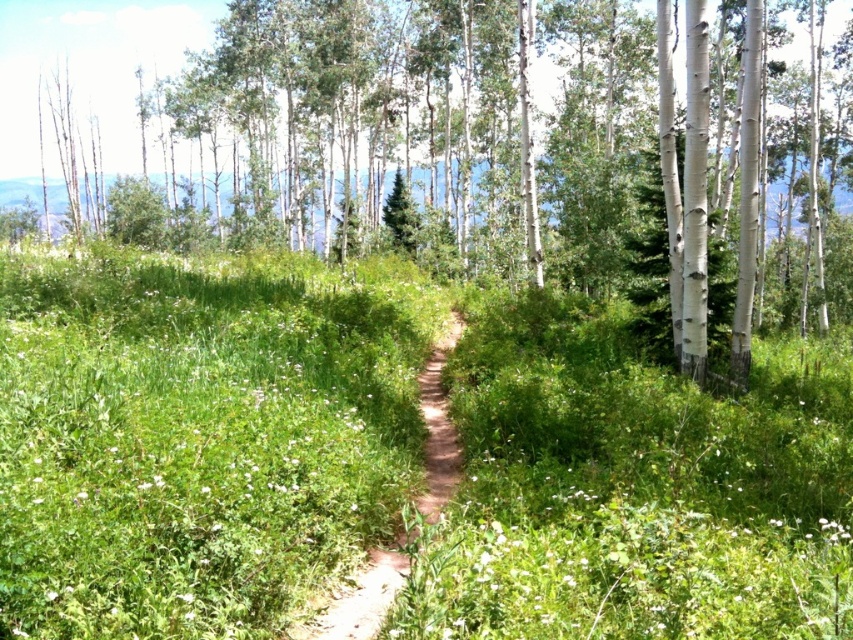
Can you confirm if green leafy tree at center is positioned to the right of brown dirt path at center?

In fact, green leafy tree at center is to the left of brown dirt path at center.

Is point (496, 33) positioned in front of point (345, 630)?

No.

Where is `green leafy tree at center`? The width and height of the screenshot is (853, 640). green leafy tree at center is located at coordinates (424, 128).

From the picture: Can you confirm if green grassy at center is smaller than brown dirt path at center?

No.

Does green grassy at center appear under brown dirt path at center?

Actually, green grassy at center is above brown dirt path at center.

Image resolution: width=853 pixels, height=640 pixels. In order to click on green grassy at center in this screenshot , I will do `click(196, 435)`.

Measure the distance between green grassy at center and camera.

3.37 meters

Which is above, green grassy at center or green leafy tree at center?

Positioned higher is green leafy tree at center.

Does point (807, 445) come farther from viewer compared to point (512, 33)?

No, (807, 445) is in front of (512, 33).

Where is `green grassy at center`? This screenshot has width=853, height=640. green grassy at center is located at coordinates (196, 435).